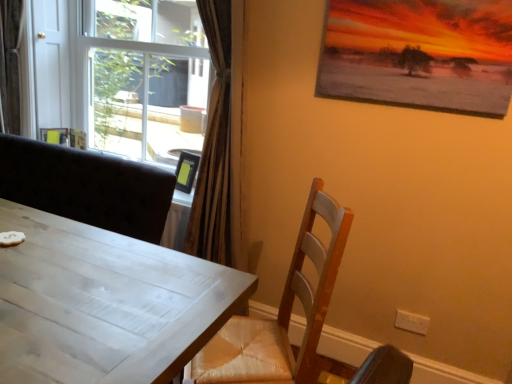
Question: Could you tell me if matte wooden picture frame at upper right is facing white wood table at left?

Choices:
 (A) yes
 (B) no

Answer: (B)

Question: Considering the relative sizes of matte wooden picture frame at upper right and white wood table at left in the image provided, is matte wooden picture frame at upper right bigger than white wood table at left?

Choices:
 (A) no
 (B) yes

Answer: (A)

Question: Is matte wooden picture frame at upper right behind white wood table at left?

Choices:
 (A) no
 (B) yes

Answer: (B)

Question: From the image's perspective, is matte wooden picture frame at upper right under white wood table at left?

Choices:
 (A) yes
 (B) no

Answer: (B)

Question: From a real-world perspective, is matte wooden picture frame at upper right below white wood table at left?

Choices:
 (A) yes
 (B) no

Answer: (B)

Question: Is matte wooden picture frame at upper right smaller than white wood table at left?

Choices:
 (A) no
 (B) yes

Answer: (B)

Question: From a real-world perspective, is white wood table at left below white plastic window at upper left?

Choices:
 (A) no
 (B) yes

Answer: (B)

Question: Is white wood table at left positioned behind white plastic window at upper left?

Choices:
 (A) no
 (B) yes

Answer: (A)

Question: From the image's perspective, does white wood table at left appear higher than white plastic window at upper left?

Choices:
 (A) no
 (B) yes

Answer: (A)

Question: Does white wood table at left have a lesser width compared to white plastic window at upper left?

Choices:
 (A) no
 (B) yes

Answer: (B)

Question: Does white wood table at left have a greater height compared to white plastic window at upper left?

Choices:
 (A) no
 (B) yes

Answer: (A)

Question: Is white wood table at left oriented towards white plastic window at upper left?

Choices:
 (A) yes
 (B) no

Answer: (B)

Question: Is wooden chair at right not within white plastic window at upper left?

Choices:
 (A) no
 (B) yes

Answer: (B)